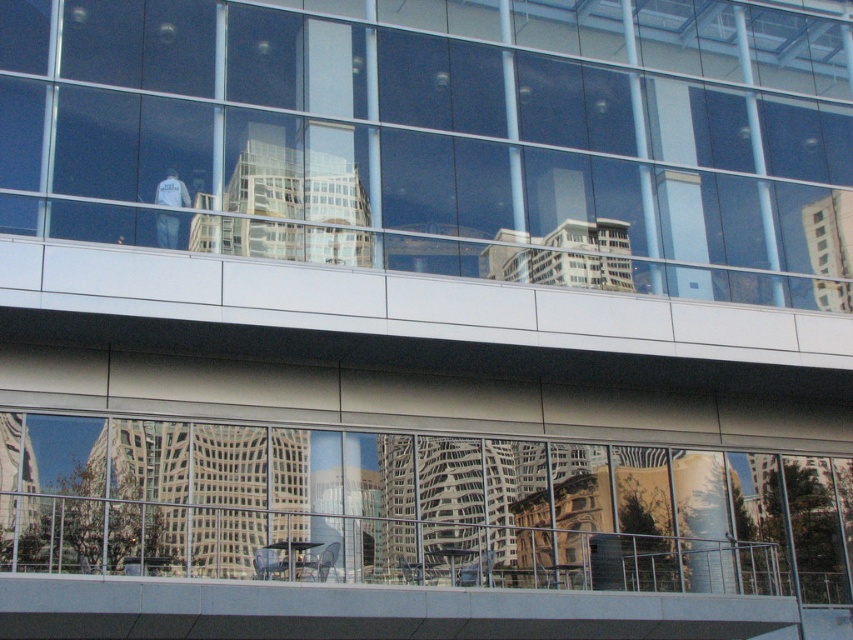
Based on the photo, you are standing outside the modern building and want to look through the transparent glass window at center and the transparent glass windows at lower center. Which window allows you to see closer to the building?

The transparent glass window at center is closer to you, so it allows you to see closer to the building than the transparent glass windows at lower center.

You are standing in front of the modern building and notice two transparent glass sections. The first is the transparent glass window at center, and the second is the transparent glass windows at lower center. Which of these two glass sections is positioned to the left when viewed from your perspective?

The transparent glass window at center is positioned to the left of the transparent glass windows at lower center.